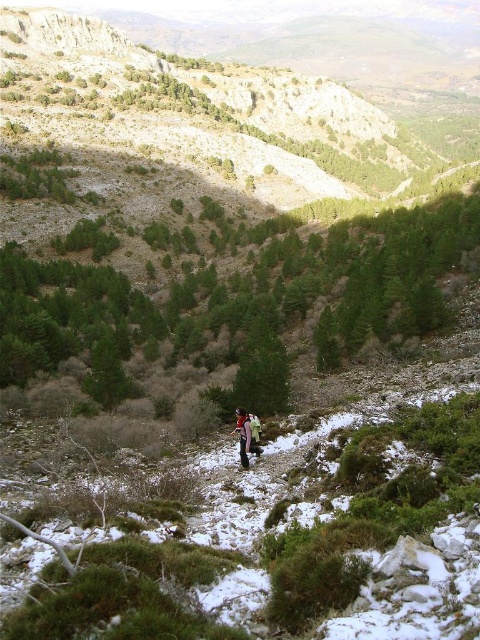
Question: Which of the following is the closest to the observer?

Choices:
 (A) red fabric jacket at center
 (B) green coniferous trees at center

Answer: (A)

Question: Can you confirm if green coniferous trees at center is wider than red fabric jacket at center?

Choices:
 (A) no
 (B) yes

Answer: (B)

Question: Can you confirm if green coniferous trees at center is bigger than red fabric jacket at center?

Choices:
 (A) no
 (B) yes

Answer: (B)

Question: Is green coniferous trees at center above red fabric jacket at center?

Choices:
 (A) no
 (B) yes

Answer: (B)